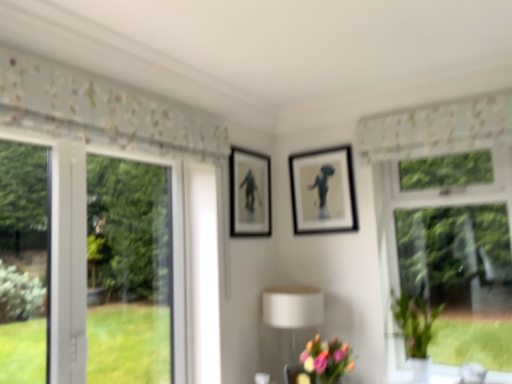
Question: Is matte black picture frame at center, acting as the 2th picture frame starting from the left, facing towards pastel bouquet at lower center?

Choices:
 (A) no
 (B) yes

Answer: (A)

Question: Is pastel bouquet at lower center at the back of matte black picture frame at center, which is the 1th picture frame from right to left?

Choices:
 (A) yes
 (B) no

Answer: (B)

Question: From a real-world perspective, is matte black picture frame at center, acting as the 2th picture frame starting from the left, positioned under pastel bouquet at lower center based on gravity?

Choices:
 (A) yes
 (B) no

Answer: (B)

Question: Could pastel bouquet at lower center be considered to be inside matte black picture frame at center, acting as the 2th picture frame starting from the left?

Choices:
 (A) no
 (B) yes

Answer: (A)

Question: Does matte black picture frame at center, acting as the 2th picture frame starting from the left, come in front of pastel bouquet at lower center?

Choices:
 (A) yes
 (B) no

Answer: (B)

Question: From a real-world perspective, is green glossy vase at right positioned under black matte picture frame at center, which is counted as the second picture frame, starting from the right, based on gravity?

Choices:
 (A) no
 (B) yes

Answer: (B)

Question: Is green glossy vase at right positioned far away from black matte picture frame at center, which is counted as the second picture frame, starting from the right?

Choices:
 (A) yes
 (B) no

Answer: (A)

Question: Does green glossy vase at right appear on the left side of black matte picture frame at center, which is counted as the 1th picture frame, starting from the left?

Choices:
 (A) no
 (B) yes

Answer: (A)

Question: Considering the relative sizes of green glossy vase at right and black matte picture frame at center, which is counted as the second picture frame, starting from the right, in the image provided, is green glossy vase at right smaller than black matte picture frame at center, which is counted as the second picture frame, starting from the right,?

Choices:
 (A) yes
 (B) no

Answer: (B)

Question: Is green glossy vase at right closer to the viewer compared to black matte picture frame at center, which is counted as the 1th picture frame, starting from the left?

Choices:
 (A) no
 (B) yes

Answer: (B)

Question: Is black matte picture frame at center, which is counted as the 1th picture frame, starting from the left, a part of green glossy vase at right?

Choices:
 (A) no
 (B) yes

Answer: (A)

Question: Considering the relative sizes of green glossy vase at right and white floral fabric at upper center in the image provided, is green glossy vase at right smaller than white floral fabric at upper center?

Choices:
 (A) yes
 (B) no

Answer: (B)